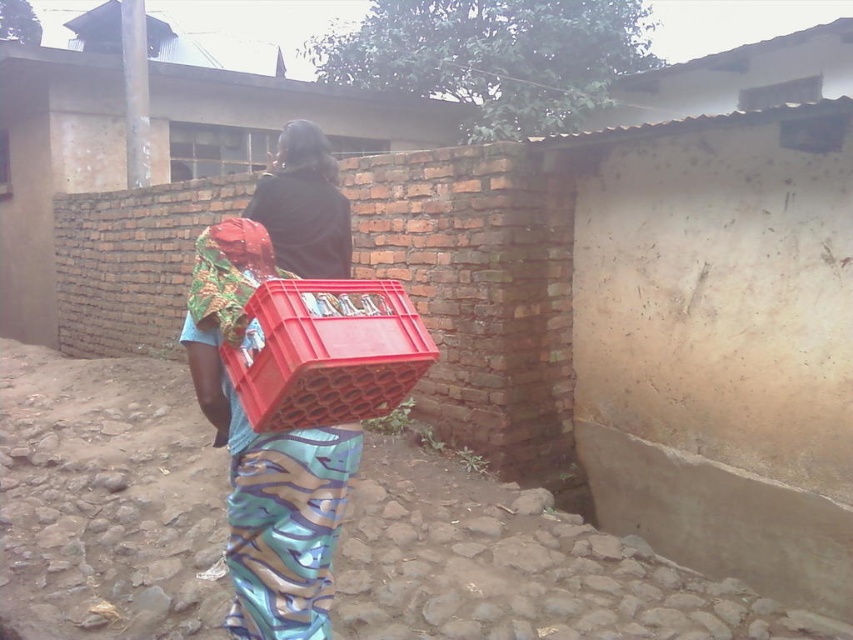
You are standing at the point with coordinates point (244, 336) and want to walk to the point with coordinates point (311, 547). Given the uneven stone ground in the scene, will you have to walk forward or backward to reach your destination?

You will have to walk forward to reach point (311, 547) because it is located behind point (244, 336) in the scene.

You are a delivery person who needs to place a package into one of the crates. The package is 30 cm wide. Which crate from the matte plastic crate at center and red plastic crate at center can it fit into?

The red plastic crate at center has a greater width than the matte plastic crate at center, so the package can fit into the red plastic crate at center if its width is at least 30 cm. However, the exact width of the red plastic crate at center is not provided, so we cannot confirm for certain. But since it is wider than the matte one, it is the better option.

You are a photographer trying to capture a candid shot of the person with dark brown hair at center without the red plastic crate at center blocking the view. Can you adjust your position to do so?

The red plastic crate at center is in front of the dark brown hair at center, so moving your position behind the crate or to the side might allow you to capture the person without obstruction.